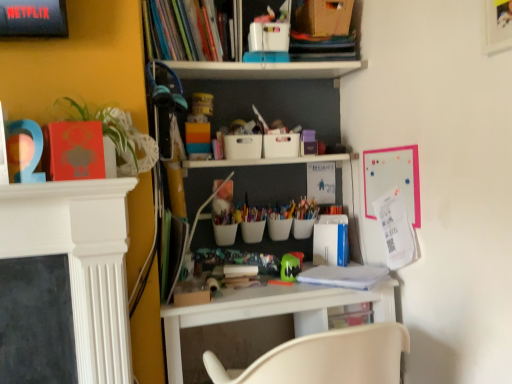
Identify the location of free spot in front of green rubber toy at center. The height and width of the screenshot is (384, 512). (304, 286).